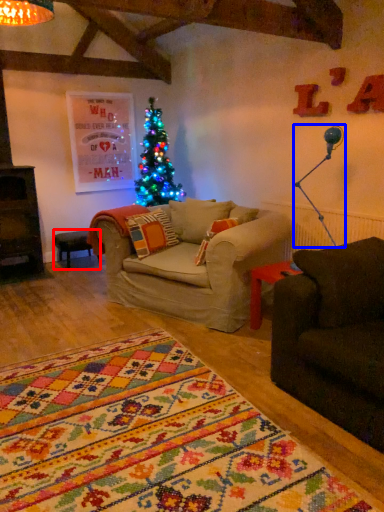
Question: Which object is further to the camera taking this photo, table (highlighted by a red box) or lamp (highlighted by a blue box)?

Choices:
 (A) table
 (B) lamp

Answer: (A)